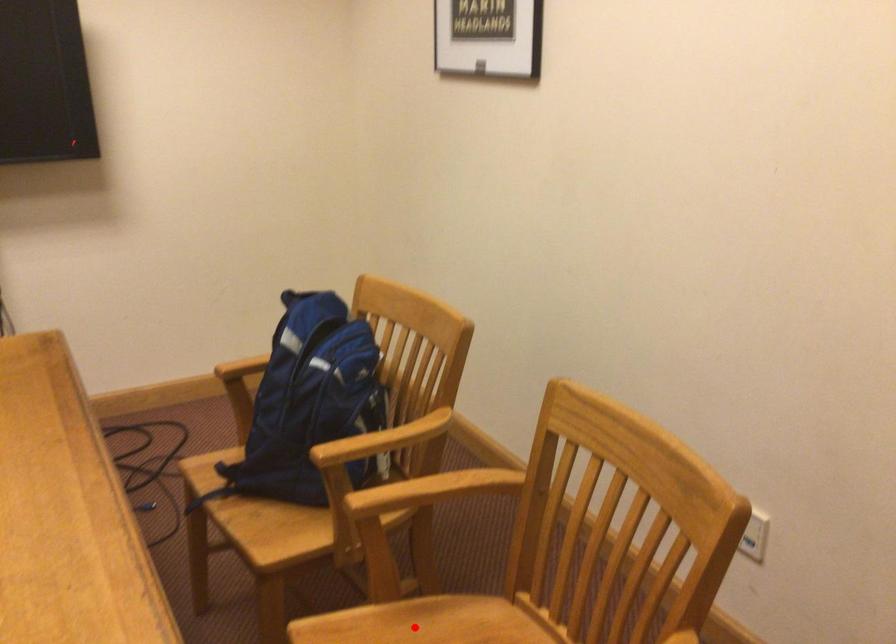
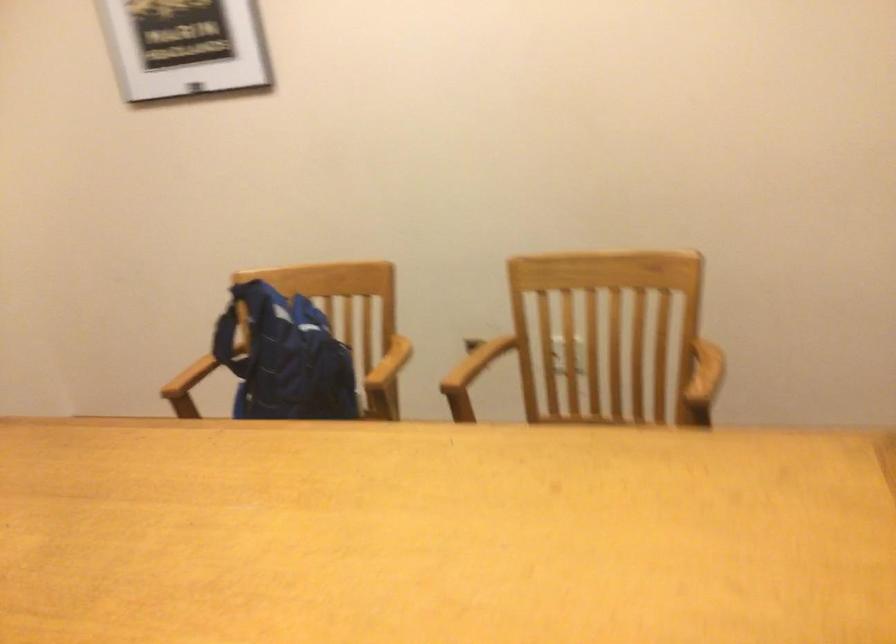
Question: I am providing you with two images of the same scene from different viewpoints. A red point is marked on the first image. Can you still see the location of the red point in image 2?

Choices:
 (A) Yes
 (B) No

Answer: (B)